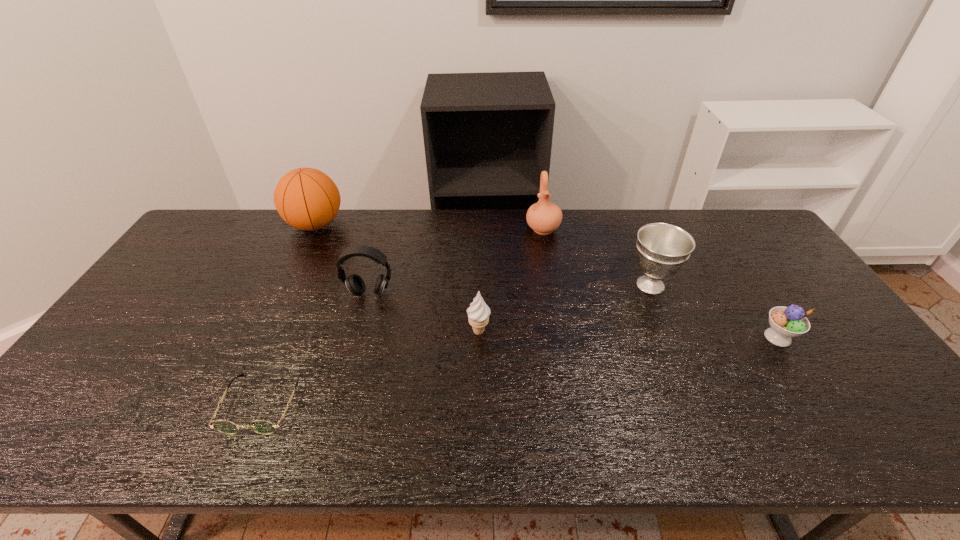
The height and width of the screenshot is (540, 960). I want to click on free space that satisfies the following two spatial constraints: 1. on the spout of the right icecream; 2. on the right side of the pottery, so click(x=563, y=338).